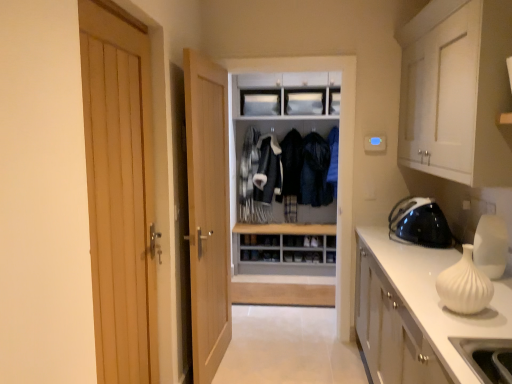
Where is `free space in front of white matte vase at right`? This screenshot has width=512, height=384. free space in front of white matte vase at right is located at coordinates (473, 326).